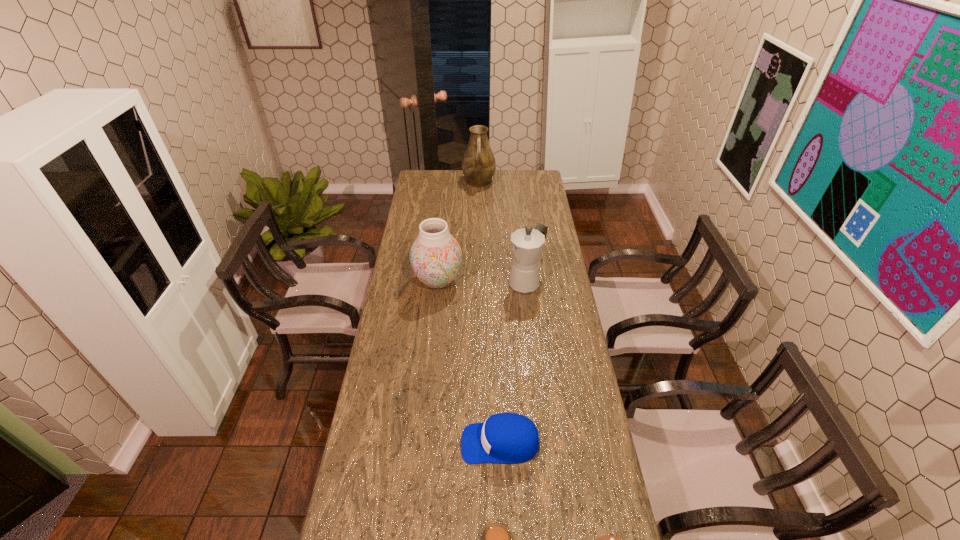
The height and width of the screenshot is (540, 960). I want to click on pitcher, so click(x=478, y=164).

What are the coordinates of `coffeepot` in the screenshot? It's located at (527, 244).

I want to click on vase, so click(435, 256).

Where is `the third nearest object`? the third nearest object is located at coordinates (508, 438).

Where is `free location located on the handle side of the pitcher`? free location located on the handle side of the pitcher is located at coordinates (479, 205).

Locate an element on the screen. Image resolution: width=960 pixels, height=540 pixels. vacant area situated on the back of the coffeepot is located at coordinates (522, 249).

The image size is (960, 540). I want to click on free point located 0.090m on the right of the vase, so click(x=484, y=281).

Where is `free space located 0.310m on the front-facing side of the fourth farthest object`? The height and width of the screenshot is (540, 960). free space located 0.310m on the front-facing side of the fourth farthest object is located at coordinates (360, 443).

At what (x,y) coordinates should I click in order to perform the action: click on blank area located 0.240m on the front-facing side of the fourth farthest object. Please return your answer as a coordinate pair (x, y). The width and height of the screenshot is (960, 540). Looking at the image, I should click on (383, 443).

Find the location of a particular element. free region located 0.300m on the front-facing side of the fourth farthest object is located at coordinates (364, 443).